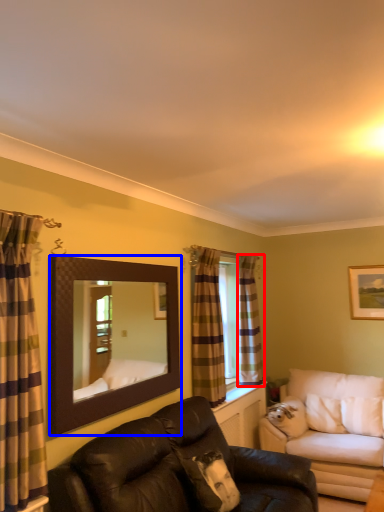
Question: Which of the following is the farthest to the observer, curtain (highlighted by a red box) or mirror (highlighted by a blue box)?

Choices:
 (A) curtain
 (B) mirror

Answer: (A)